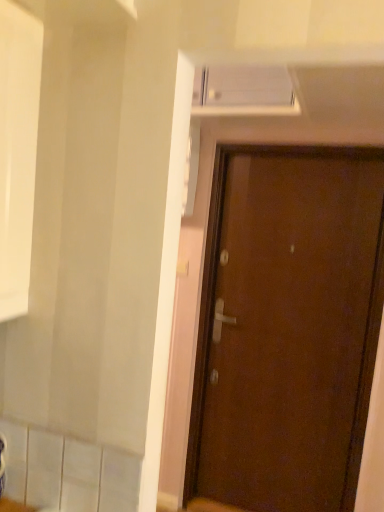
What do you see at coordinates (287, 328) in the screenshot? I see `brown matte door at center` at bounding box center [287, 328].

You are a GUI agent. You are given a task and a screenshot of the screen. Output one action in this format:
    pyautogui.click(x=<x>, y=<y>)
    Task: Click on the brown matte door at center
    The image size is (384, 512).
    Given the screenshot: What is the action you would take?
    pyautogui.click(x=287, y=328)

Find the location of a particular element. brown matte door at center is located at coordinates (287, 328).